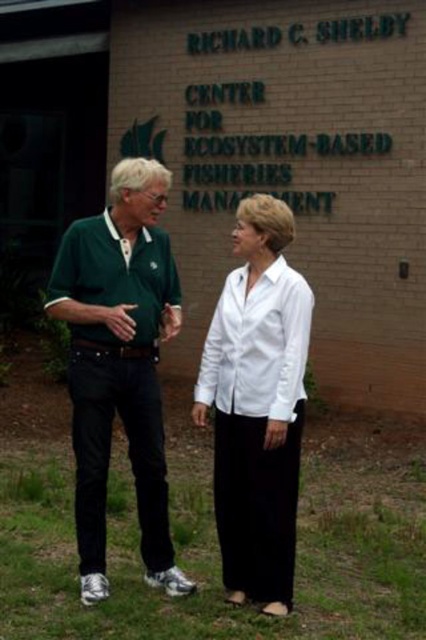
You are a photographer trying to capture a group photo of the green jersey at center and the white smooth shirt at center. You want to ensure both subjects are fully visible in the frame. Based on their clothing dimensions, which subject requires a wider framing area?

The green jersey at center requires a wider framing area because its width surpasses that of the white smooth shirt at center.

Consider the image. You are a photographer trying to capture a photo of both the green jersey at center and the white smooth shirt at center in the same frame. The camera you are using has a minimum focus distance of 25 inches. Will you be able to take the photo without moving either of the subjects?

The green jersey at center and white smooth shirt at center are 24.73 inches apart from each other, which is less than the camera minimum focus distance of 25 inches. Therefore, you can take the photo without moving either subject.

You are a photographer trying to capture a group photo of the white smooth blouse at center and the white smooth shirt at center. The camera you have can only focus on objects within a 15 centimeter range. Do you think both subjects will be in focus?

The white smooth blouse at center and white smooth shirt at center are 15.86 centimeters apart. Since the camera can only focus within a 15 centimeter range, the distance between them exceeds the focus range. Therefore, both subjects may not be in focus simultaneously.